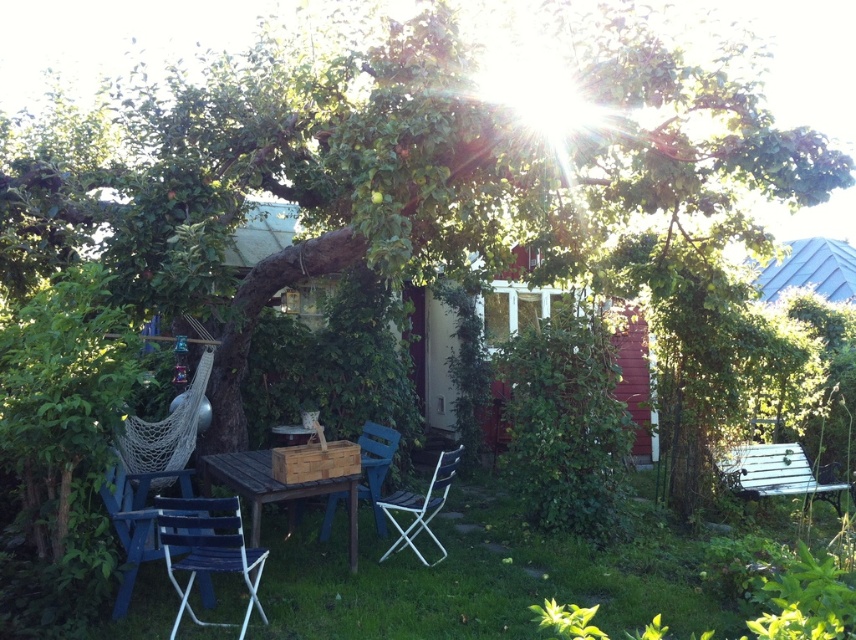
Question: Which of the following is the closest to the observer?

Choices:
 (A) (774, 452)
 (B) (825, 253)

Answer: (A)

Question: Among these points, which one is nearest to the camera?

Choices:
 (A) (785, 275)
 (B) (432, 481)
 (C) (735, 448)
 (D) (351, 560)

Answer: (D)

Question: Which of the following is the closest to the observer?

Choices:
 (A) metallic silver bench at right
 (B) wooden hut at center

Answer: (A)

Question: Considering the relative positions of wooden hut at center and blue wood chair at center in the image provided, where is wooden hut at center located with respect to blue wood chair at center?

Choices:
 (A) below
 (B) above

Answer: (B)

Question: Does metallic silver bench at right appear on the right side of metallic silver chair at lower center?

Choices:
 (A) yes
 (B) no

Answer: (A)

Question: Is blue wood chair at lower left wider than blue corrugated metal hut at upper right?

Choices:
 (A) no
 (B) yes

Answer: (A)